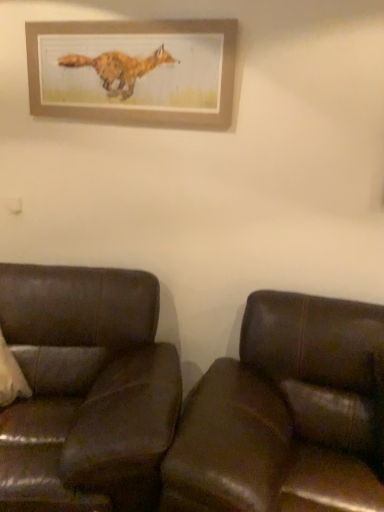
Question: Is brown leather couch at left, the 2th studio couch from the right, positioned before brown leather couch at lower right, marked as the 1th studio couch in a right-to-left arrangement?

Choices:
 (A) no
 (B) yes

Answer: (A)

Question: From a real-world perspective, is brown leather couch at left, which is the 1th studio couch from left to right, located beneath brown leather couch at lower right, marked as the 1th studio couch in a right-to-left arrangement?

Choices:
 (A) no
 (B) yes

Answer: (B)

Question: Considering the relative sizes of brown leather couch at left, which is the 1th studio couch from left to right, and brown leather couch at lower right, marked as the 1th studio couch in a right-to-left arrangement, in the image provided, is brown leather couch at left, which is the 1th studio couch from left to right, taller than brown leather couch at lower right, marked as the 1th studio couch in a right-to-left arrangement,?

Choices:
 (A) no
 (B) yes

Answer: (A)

Question: Can brown leather couch at lower right, the second studio couch when ordered from left to right, be found inside brown leather couch at left, the 2th studio couch from the right?

Choices:
 (A) yes
 (B) no

Answer: (B)

Question: Does brown leather couch at left, which is the 1th studio couch from left to right, have a smaller size compared to brown leather couch at lower right, marked as the 1th studio couch in a right-to-left arrangement?

Choices:
 (A) no
 (B) yes

Answer: (A)

Question: Considering the positions of wooden picture frame at upper center and brown leather couch at left, which is the 1th studio couch from left to right, in the image, is wooden picture frame at upper center taller or shorter than brown leather couch at left, which is the 1th studio couch from left to right,?

Choices:
 (A) tall
 (B) short

Answer: (B)

Question: Considering the positions of wooden picture frame at upper center and brown leather couch at left, which is the 1th studio couch from left to right, in the image, is wooden picture frame at upper center wider or thinner than brown leather couch at left, which is the 1th studio couch from left to right,?

Choices:
 (A) thin
 (B) wide

Answer: (A)

Question: Relative to brown leather couch at left, the 2th studio couch from the right, is wooden picture frame at upper center in front or behind?

Choices:
 (A) front
 (B) behind

Answer: (B)

Question: Would you say wooden picture frame at upper center is inside or outside brown leather couch at left, the 2th studio couch from the right?

Choices:
 (A) inside
 (B) outside

Answer: (B)

Question: From their relative heights in the image, would you say brown leather couch at lower right, marked as the 1th studio couch in a right-to-left arrangement, is taller or shorter than wooden picture frame at upper center?

Choices:
 (A) tall
 (B) short

Answer: (A)

Question: Does point (228, 385) appear closer or farther from the camera than point (208, 47)?

Choices:
 (A) closer
 (B) farther

Answer: (A)

Question: Is brown leather couch at lower right, marked as the 1th studio couch in a right-to-left arrangement, wider or thinner than wooden picture frame at upper center?

Choices:
 (A) wide
 (B) thin

Answer: (A)

Question: From the image's perspective, is brown leather couch at lower right, marked as the 1th studio couch in a right-to-left arrangement, above or below wooden picture frame at upper center?

Choices:
 (A) above
 (B) below

Answer: (B)

Question: From the image's perspective, is brown leather couch at lower right, the second studio couch when ordered from left to right, above or below brown leather couch at left, which is the 1th studio couch from left to right?

Choices:
 (A) below
 (B) above

Answer: (A)

Question: Is point coord(261,399) positioned closer to the camera than point coord(117,312)?

Choices:
 (A) closer
 (B) farther

Answer: (A)